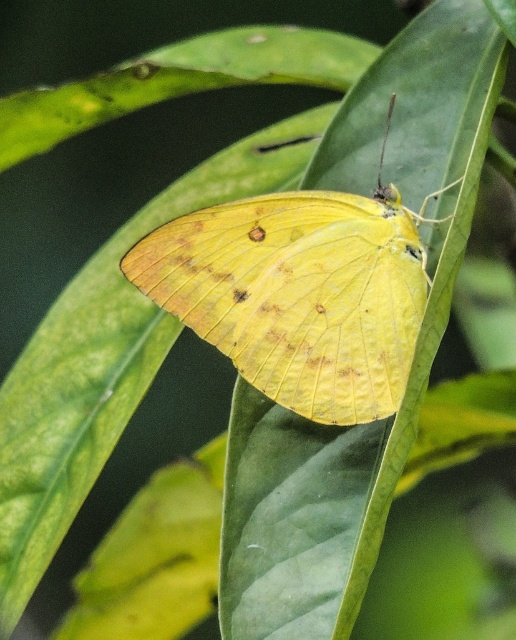
Question: Where is green matte leaf at center located in relation to yellow matte butterfly at center in the image?

Choices:
 (A) above
 (B) below

Answer: (B)

Question: Among these objects, which one is nearest to the camera?

Choices:
 (A) yellow matte butterfly at center
 (B) green matte leaf at center

Answer: (B)

Question: Which point appears farthest from the camera in this image?

Choices:
 (A) (293, 566)
 (B) (137, 252)

Answer: (B)

Question: From the image, what is the correct spatial relationship of green matte leaf at center in relation to yellow matte butterfly at center?

Choices:
 (A) left
 (B) right

Answer: (B)

Question: Is green matte leaf at center positioned in front of yellow matte butterfly at center?

Choices:
 (A) yes
 (B) no

Answer: (A)

Question: Which point is farther from the camera taking this photo?

Choices:
 (A) (325, 300)
 (B) (319, 618)

Answer: (A)